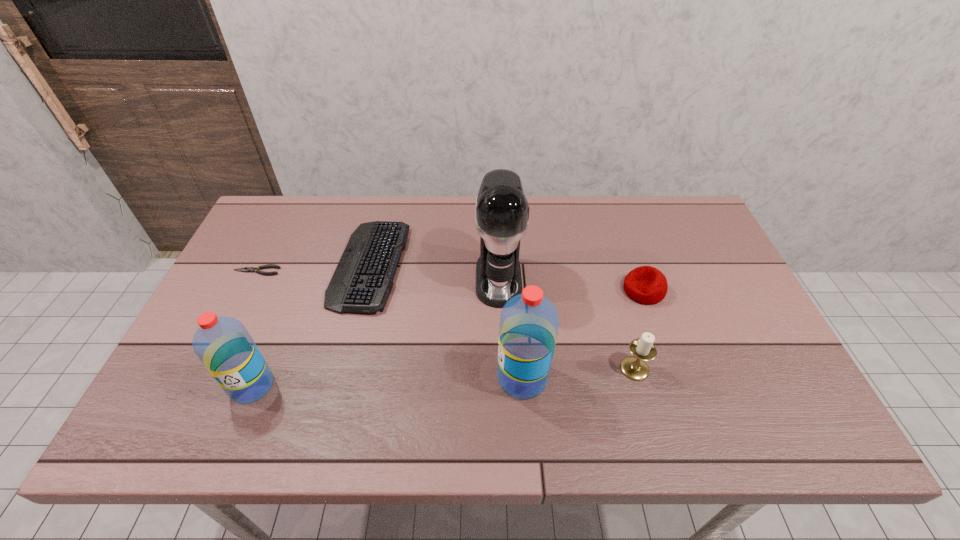
Where is `free spot between the shortest object and the candle holder`? free spot between the shortest object and the candle holder is located at coordinates (445, 320).

You are a GUI agent. You are given a task and a screenshot of the screen. Output one action in this format:
    pyautogui.click(x=<x>, y=<y>)
    Task: Click on the empty space between the third shortest object and the shortest object
    
    Given the screenshot: What is the action you would take?
    pyautogui.click(x=450, y=281)

Find the location of a particular element. Image resolution: width=960 pixels, height=540 pixels. free space between the candle holder and the third shortest object is located at coordinates (639, 329).

Identify the location of free space between the left water bottle and the pliers. Image resolution: width=960 pixels, height=540 pixels. (254, 328).

I want to click on free spot between the right water bottle and the candle holder, so click(x=579, y=373).

Where is `unoccupied position between the shorter water bottle and the candle holder`? unoccupied position between the shorter water bottle and the candle holder is located at coordinates (444, 377).

Image resolution: width=960 pixels, height=540 pixels. Find the location of `empty space between the beanbag and the coffee maker`. empty space between the beanbag and the coffee maker is located at coordinates (571, 285).

This screenshot has width=960, height=540. I want to click on free space between the taller water bottle and the third shortest object, so click(x=583, y=334).

Identify the location of object that is the fourth closest to the shorter water bottle. (529, 322).

Where is `object that is the closest to the candle holder`? object that is the closest to the candle holder is located at coordinates (646, 285).